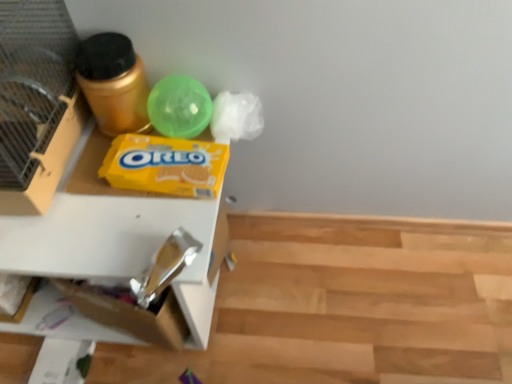
Question: Should I look upward or downward to see yellow cardboard oreo box at center?

Choices:
 (A) down
 (B) up

Answer: (B)

Question: Is translucent green ball at upper center in front of wooden floor at lower right?

Choices:
 (A) no
 (B) yes

Answer: (B)

Question: From the image's perspective, does translucent green ball at upper center appear lower than wooden floor at lower right?

Choices:
 (A) no
 (B) yes

Answer: (A)

Question: Can you confirm if translucent green ball at upper center is wider than wooden floor at lower right?

Choices:
 (A) no
 (B) yes

Answer: (A)

Question: Is translucent green ball at upper center facing away from wooden floor at lower right?

Choices:
 (A) no
 (B) yes

Answer: (A)

Question: Is translucent green ball at upper center smaller than wooden floor at lower right?

Choices:
 (A) no
 (B) yes

Answer: (B)

Question: From a real-world perspective, is translucent green ball at upper center physically below wooden floor at lower right?

Choices:
 (A) no
 (B) yes

Answer: (A)

Question: From a real-world perspective, is gold metallic canister at upper left located beneath white cardboard drawer at left?

Choices:
 (A) yes
 (B) no

Answer: (B)

Question: Is gold metallic canister at upper left looking in the opposite direction of white cardboard drawer at left?

Choices:
 (A) yes
 (B) no

Answer: (B)

Question: Is gold metallic canister at upper left bigger than white cardboard drawer at left?

Choices:
 (A) no
 (B) yes

Answer: (A)

Question: Is gold metallic canister at upper left directly adjacent to white cardboard drawer at left?

Choices:
 (A) no
 (B) yes

Answer: (A)

Question: Is gold metallic canister at upper left taller than white cardboard drawer at left?

Choices:
 (A) yes
 (B) no

Answer: (B)

Question: Considering the relative sizes of gold metallic canister at upper left and white cardboard drawer at left in the image provided, is gold metallic canister at upper left wider than white cardboard drawer at left?

Choices:
 (A) no
 (B) yes

Answer: (A)

Question: Considering the relative sizes of translucent green ball at upper center and gold metallic canister at upper left in the image provided, is translucent green ball at upper center bigger than gold metallic canister at upper left?

Choices:
 (A) yes
 (B) no

Answer: (B)